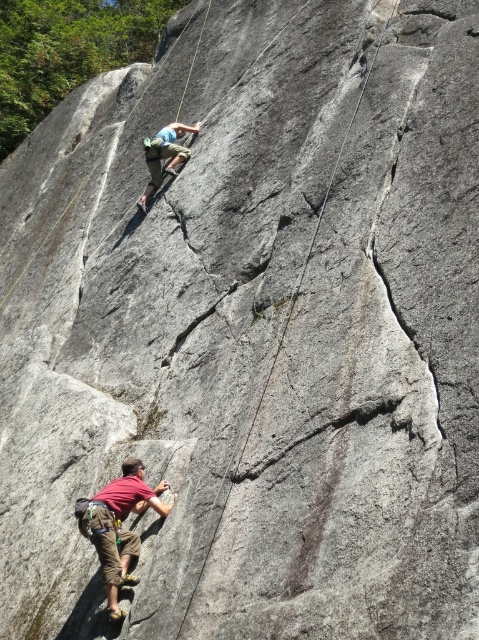
Question: Which point appears farthest from the camera in this image?

Choices:
 (A) (128, 576)
 (B) (150, 195)
 (C) (320, 211)

Answer: (B)

Question: Can you confirm if reddish-brown fabric climbing harness at lower left is positioned below smooth gray rope at center?

Choices:
 (A) yes
 (B) no

Answer: (A)

Question: Can you confirm if reddish-brown fabric climbing harness at lower left is positioned above smooth gray rope at center?

Choices:
 (A) yes
 (B) no

Answer: (B)

Question: Which object is the farthest from the blue t-shirt at upper center?

Choices:
 (A) smooth gray rope at center
 (B) reddish-brown fabric climbing harness at lower left

Answer: (B)

Question: Does reddish-brown fabric climbing harness at lower left lie in front of blue t-shirt at upper center?

Choices:
 (A) no
 (B) yes

Answer: (B)

Question: Which object appears farthest from the camera in this image?

Choices:
 (A) reddish-brown fabric climbing harness at lower left
 (B) smooth gray rope at center

Answer: (A)